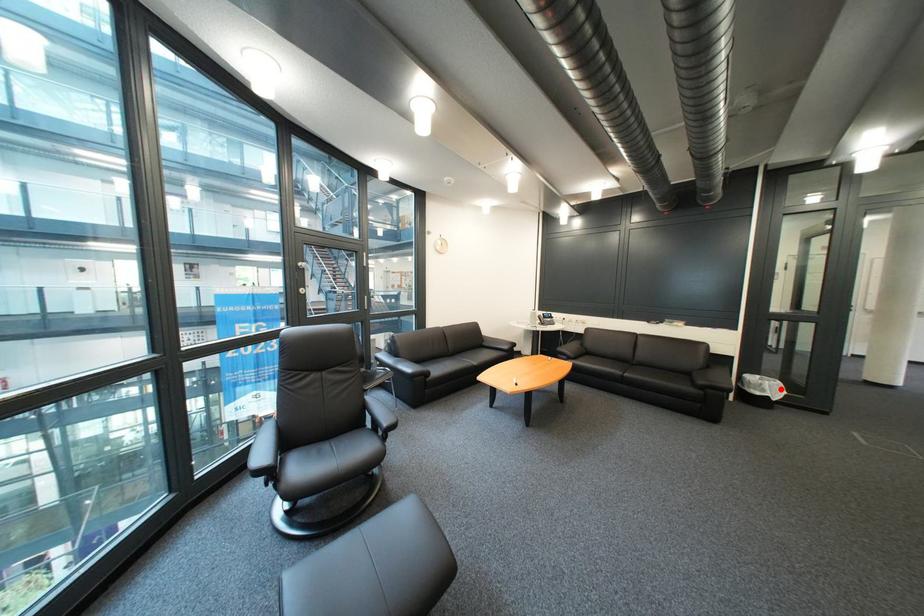
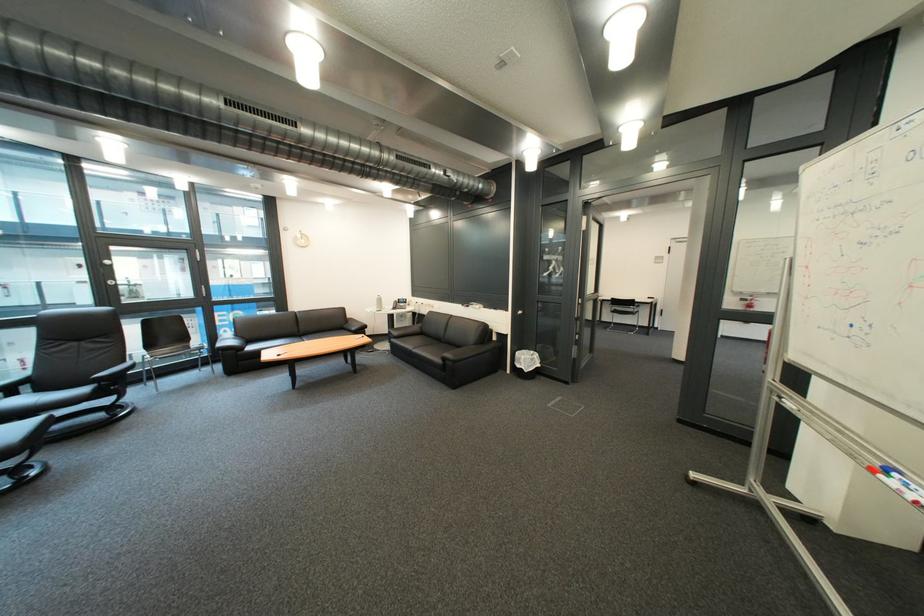
Where in the second image is the point corresponding to the highlighted location from the first image?

(536, 363)